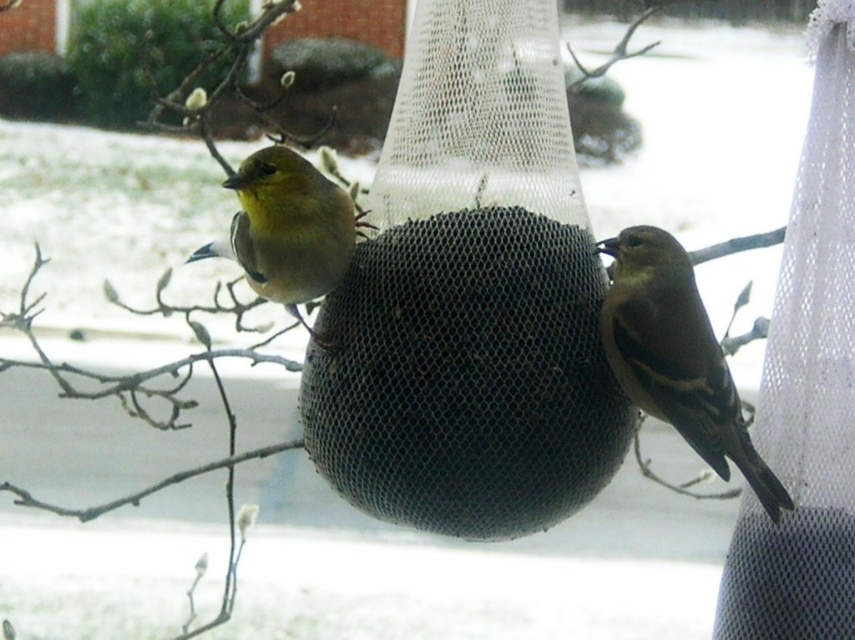
Question: Can you confirm if brown matte sparrow at center is thinner than yellow matte bird at center?

Choices:
 (A) yes
 (B) no

Answer: (A)

Question: Which point is closer to the camera?

Choices:
 (A) brown matte sparrow at center
 (B) yellow matte bird at center

Answer: (B)

Question: Does brown matte sparrow at center have a greater width compared to yellow matte bird at center?

Choices:
 (A) yes
 (B) no

Answer: (B)

Question: From the image, what is the correct spatial relationship of brown matte sparrow at center in relation to yellow matte bird at center?

Choices:
 (A) right
 (B) left

Answer: (A)

Question: Which point is farther to the camera?

Choices:
 (A) (276, 205)
 (B) (622, 369)

Answer: (B)